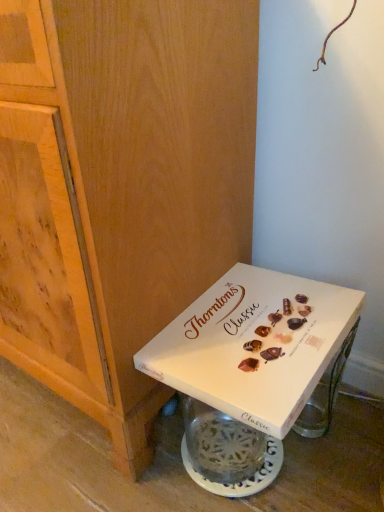
Describe the element at coordinates (119, 187) in the screenshot. I see `wooden cabinet at lower left` at that location.

What is the approximate height of wooden cabinet at lower left?

wooden cabinet at lower left is 33.25 inches tall.

This screenshot has height=512, width=384. What are the coordinates of `wooden cabinet at lower left` in the screenshot? It's located at (119, 187).

Measure the distance between point [283,339] and camera.

A distance of 26.34 inches exists between point [283,339] and camera.

I want to click on white cardboard box at lower right, so click(x=254, y=345).

This screenshot has width=384, height=512. What do you see at coordinates (254, 345) in the screenshot?
I see `white cardboard box at lower right` at bounding box center [254, 345].

Locate an element on the screen. The height and width of the screenshot is (512, 384). wooden cabinet at lower left is located at coordinates (119, 187).

Looking at this image, is wooden cabinet at lower left at the left side of white cardboard box at lower right?

Yes.

Is the depth of wooden cabinet at lower left greater than that of white cardboard box at lower right?

No, it is not.

Is point (172, 74) closer to viewer compared to point (192, 380)?

Yes, point (172, 74) is closer to viewer.

From the image's perspective, which one is positioned lower, wooden cabinet at lower left or white cardboard box at lower right?

From the image's view, white cardboard box at lower right is below.

From a real-world perspective, is wooden cabinet at lower left positioned above or below white cardboard box at lower right?

wooden cabinet at lower left is above white cardboard box at lower right.

Which object is thinner, wooden cabinet at lower left or white cardboard box at lower right?

white cardboard box at lower right is thinner.

Does wooden cabinet at lower left have a lesser height compared to white cardboard box at lower right?

No, wooden cabinet at lower left is not shorter than white cardboard box at lower right.

Looking at the image, does wooden cabinet at lower left seem bigger or smaller compared to white cardboard box at lower right?

Considering their sizes, wooden cabinet at lower left takes up more space than white cardboard box at lower right.

Is wooden cabinet at lower left inside the boundaries of white cardboard box at lower right, or outside?

wooden cabinet at lower left is not inside white cardboard box at lower right, it's outside.

Is wooden cabinet at lower left far from white cardboard box at lower right?

Actually, wooden cabinet at lower left and white cardboard box at lower right are a little close together.

Is white cardboard box at lower right at the back of wooden cabinet at lower left?

That's not correct — wooden cabinet at lower left is not looking away from white cardboard box at lower right.

The height and width of the screenshot is (512, 384). What are the coordinates of `box on the right of wooden cabinet at lower left` in the screenshot? It's located at (254, 345).

Which object is positioned more to the right, white cardboard box at lower right or wooden cabinet at lower left?

Positioned to the right is white cardboard box at lower right.

Is white cardboard box at lower right positioned before wooden cabinet at lower left?

That is False.

Considering the positions of point (237, 371) and point (5, 288), is point (237, 371) closer or farther from the camera than point (5, 288)?

Clearly, point (237, 371) is closer to the camera than point (5, 288).

From the image's perspective, which object appears higher, white cardboard box at lower right or wooden cabinet at lower left?

wooden cabinet at lower left is shown above in the image.

From a real-world perspective, relative to wooden cabinet at lower left, is white cardboard box at lower right vertically above or below?

Clearly, from a real-world perspective, white cardboard box at lower right is below wooden cabinet at lower left.

From the picture: Which object is thinner, white cardboard box at lower right or wooden cabinet at lower left?

white cardboard box at lower right is thinner.

Looking at this image, is white cardboard box at lower right taller than wooden cabinet at lower left?

Incorrect, the height of white cardboard box at lower right is not larger of that of wooden cabinet at lower left.

Which of these two, white cardboard box at lower right or wooden cabinet at lower left, is smaller?

white cardboard box at lower right is smaller.

Could wooden cabinet at lower left be considered to be inside white cardboard box at lower right?

No, white cardboard box at lower right does not contain wooden cabinet at lower left.

Is white cardboard box at lower right placed right next to wooden cabinet at lower left?

No, white cardboard box at lower right is not in contact with wooden cabinet at lower left.

Is white cardboard box at lower right positioned with its back to wooden cabinet at lower left?

No.

You are a GUI agent. You are given a task and a screenshot of the screen. Output one action in this format:
    pyautogui.click(x=<x>, y=<y>)
    Task: Click on the cabinetry on the left of the white cardboard box at lower right
    Image resolution: width=384 pixels, height=512 pixels.
    Given the screenshot: What is the action you would take?
    coord(119,187)

The image size is (384, 512). Find the location of `cabinetry that appears above the white cardboard box at lower right (from the image's perspective)`. cabinetry that appears above the white cardboard box at lower right (from the image's perspective) is located at coordinates (119, 187).

The width and height of the screenshot is (384, 512). I want to click on cabinetry that appears in front of the white cardboard box at lower right, so click(119, 187).